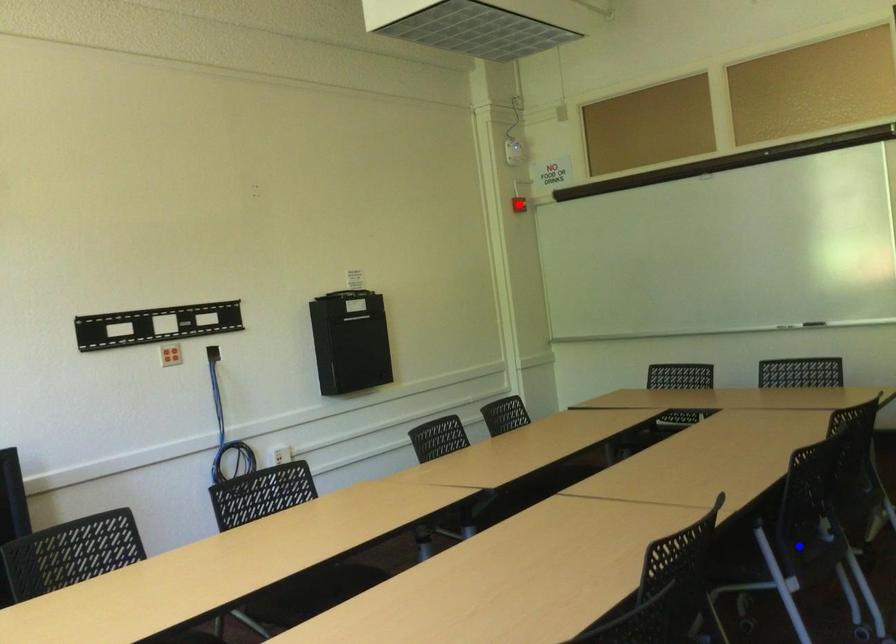
Question: In the image, two points are highlighted. Which point is nearer to the camera? Reply with the corresponding letter.

Choices:
 (A) blue point
 (B) red point

Answer: (A)